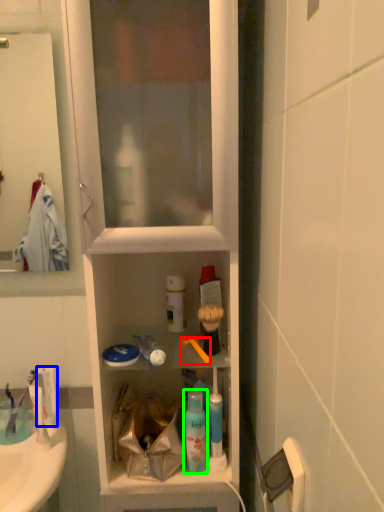
Question: Estimate the real-world distances between objects in this image. Which object is farther from brush (highlighted by a red box), toothpaste (highlighted by a blue box) or mouthwash (highlighted by a green box)?

Choices:
 (A) toothpaste
 (B) mouthwash

Answer: (A)